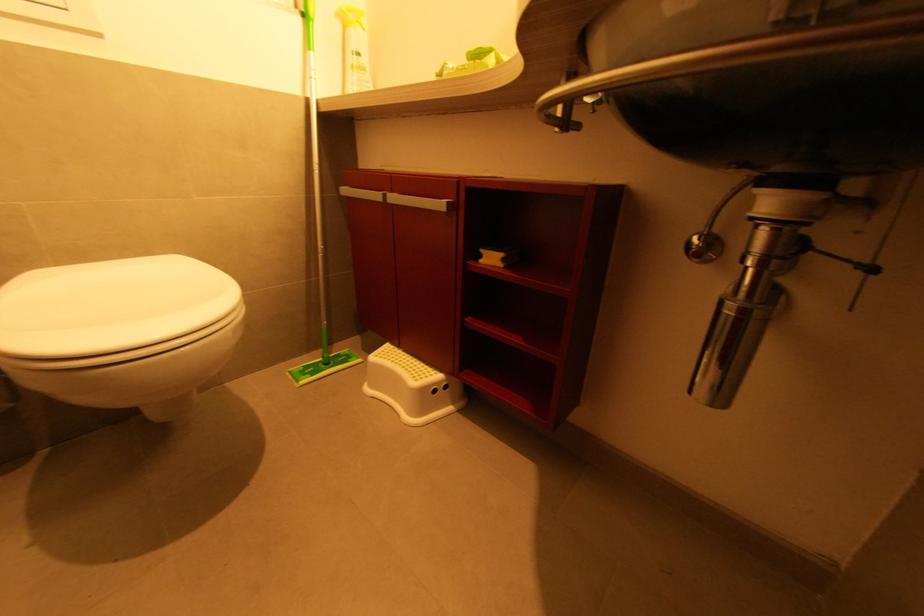
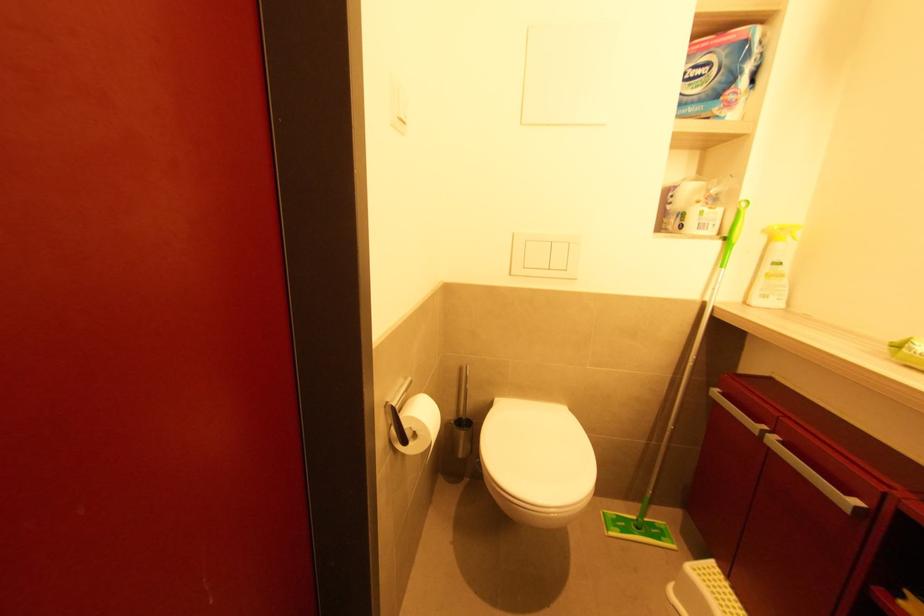
Question: The first image is from the beginning of the video and the second image is from the end. How did the camera likely rotate when shooting the video?

Choices:
 (A) Left
 (B) Right
 (C) Up
 (D) Down

Answer: (A)